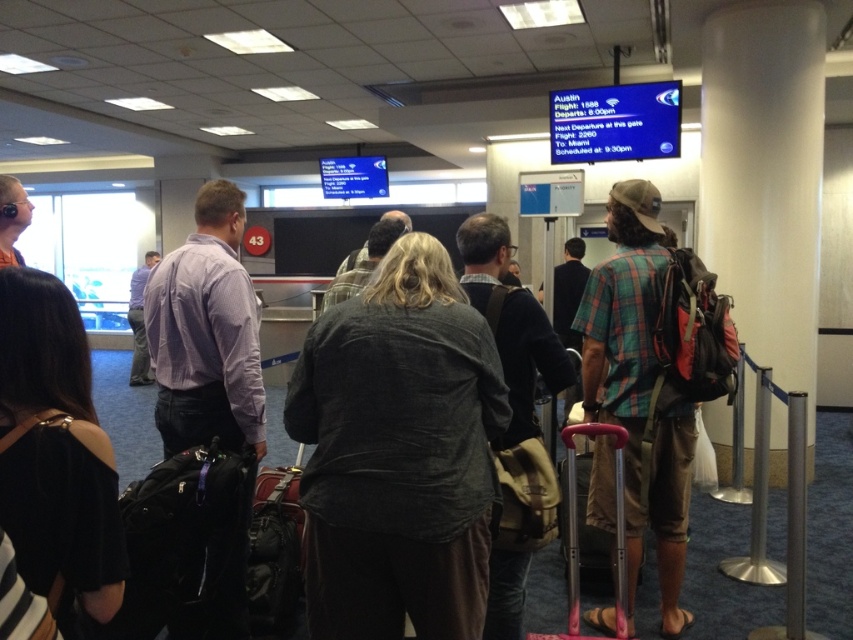
Question: Which of the following is the closest to the observer?

Choices:
 (A) metallic pink suitcase at center
 (B) leather suitcase at center
 (C) dark gray linen shirt at center

Answer: (C)

Question: Does dark gray linen shirt at center appear under leather suitcase at center?

Choices:
 (A) no
 (B) yes

Answer: (A)

Question: Which object is closer to the camera taking this photo?

Choices:
 (A) metallic pink suitcase at center
 (B) black fabric purse at lower left
 (C) plaid shirt at center
 (D) plaid fabric shirt at center

Answer: (B)

Question: Considering the relative positions of black fabric purse at lower left and plaid shirt at center in the image provided, where is black fabric purse at lower left located with respect to plaid shirt at center?

Choices:
 (A) left
 (B) right

Answer: (A)

Question: Is dark gray linen shirt at center closer to camera compared to plaid shirt at center?

Choices:
 (A) no
 (B) yes

Answer: (B)

Question: Which object is the farthest from the plaid fabric shirt at center?

Choices:
 (A) dark gray linen shirt at center
 (B) leather suitcase at center

Answer: (B)